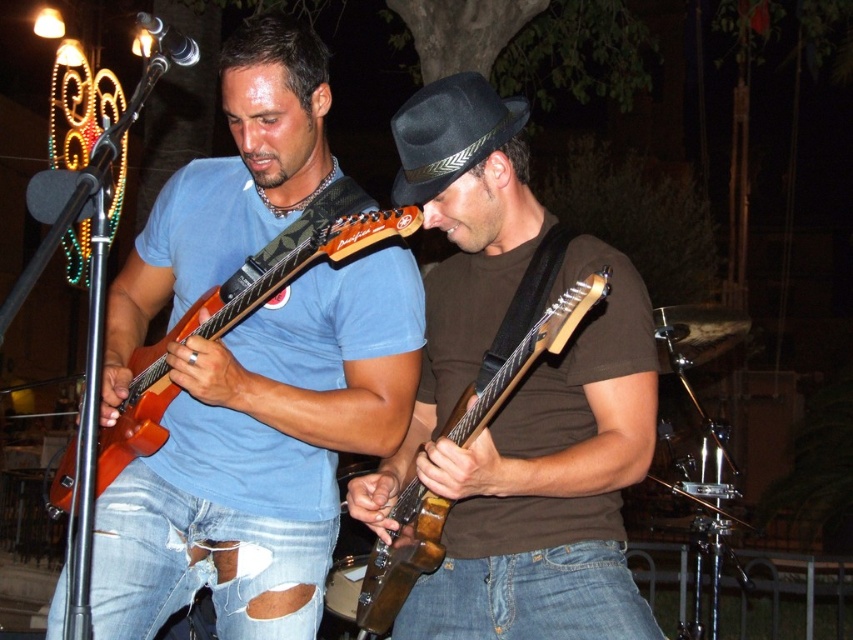
Can you confirm if orange matte electric guitar at center is bigger than wooden electric guitar at center?

Indeed, orange matte electric guitar at center has a larger size compared to wooden electric guitar at center.

Does orange matte electric guitar at center have a smaller size compared to wooden electric guitar at center?

Incorrect, orange matte electric guitar at center is not smaller in size than wooden electric guitar at center.

This screenshot has height=640, width=853. Identify the location of orange matte electric guitar at center. (244, 307).

Which is in front, point (143, 563) or point (71, 465)?

Point (143, 563) is more forward.

Does ripped denim jeans at lower left appear over orange matte electric guitar at center?

No, ripped denim jeans at lower left is not above orange matte electric guitar at center.

Between point (123, 609) and point (62, 483), which one is positioned behind?

Point (62, 483)

At what (x,y) coordinates should I click in order to perform the action: click on ripped denim jeans at lower left. Please return your answer as a coordinate pair (x, y). The image size is (853, 640). Looking at the image, I should click on (202, 563).

Which of these two, orange matte electric guitar at center or black felt fedora at center, stands shorter?

Standing shorter between the two is black felt fedora at center.

Where is `orange matte electric guitar at center`? orange matte electric guitar at center is located at coordinates (244, 307).

Identify the location of orange matte electric guitar at center. The width and height of the screenshot is (853, 640). (244, 307).